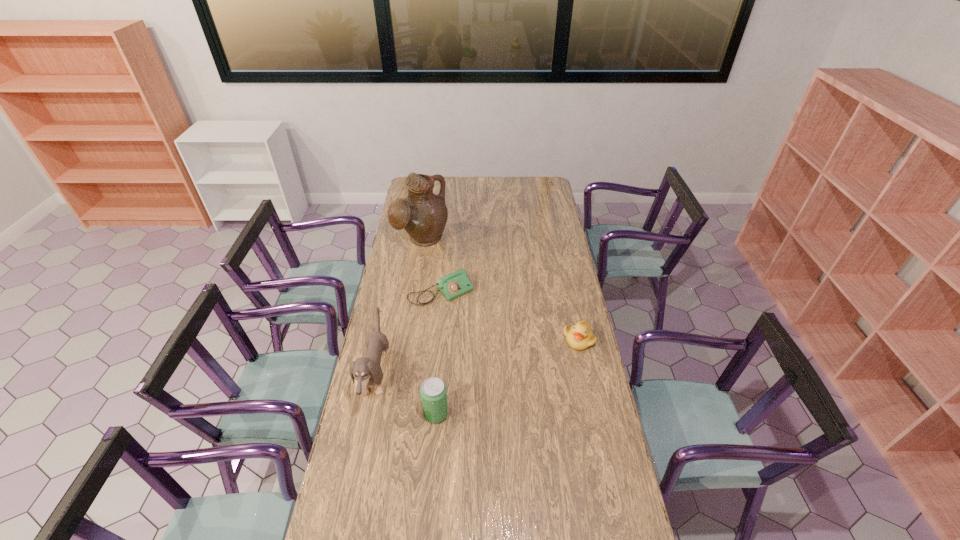
Identify the location of vacant space that satisfies the following two spatial constraints: 1. on the front side of the telephone; 2. on the right side of the soda. (430, 414).

The width and height of the screenshot is (960, 540). Find the location of `free location that satisfies the following two spatial constraints: 1. on the front side of the soda; 2. on the right side of the puppy`. free location that satisfies the following two spatial constraints: 1. on the front side of the soda; 2. on the right side of the puppy is located at coordinates (369, 414).